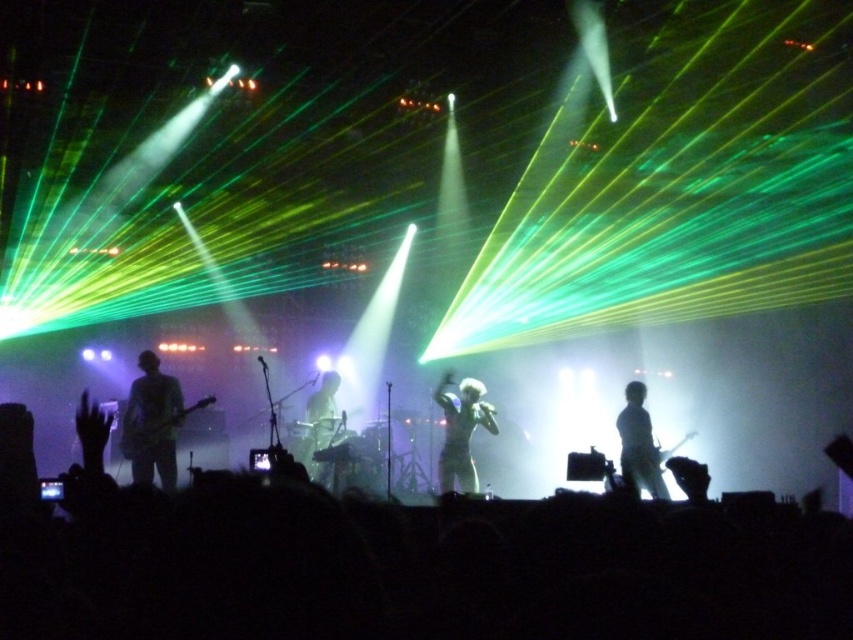
Which of these two, white metallic microphone at center or silvery metallic guitar at right, stands shorter?

Standing shorter between the two is silvery metallic guitar at right.

Between white metallic microphone at center and silvery metallic guitar at right, which one has more height?

Standing taller between the two is white metallic microphone at center.

Is point (461, 488) positioned after point (631, 449)?

Yes, it is behind point (631, 449).

This screenshot has height=640, width=853. Identify the location of white metallic microphone at center. (461, 432).

Does point (91, 486) come closer to viewer compared to point (459, 422)?

Yes, point (91, 486) is in front of point (459, 422).

Is black matte crowd at lower center below white metallic microphone at center?

Actually, black matte crowd at lower center is above white metallic microphone at center.

Is point (432, 579) in front of point (473, 481)?

Yes, point (432, 579) is closer to viewer.

Where is `black matte crowd at lower center`? The width and height of the screenshot is (853, 640). black matte crowd at lower center is located at coordinates (408, 566).

Who is higher up, black matte crowd at lower center or silvery metallic guitar at right?

black matte crowd at lower center is higher up.

From the picture: Between black matte crowd at lower center and silvery metallic guitar at right, which one is positioned lower?

Positioned lower is silvery metallic guitar at right.

The image size is (853, 640). Describe the element at coordinates (408, 566) in the screenshot. I see `black matte crowd at lower center` at that location.

Locate an element on the screen. black matte crowd at lower center is located at coordinates (408, 566).